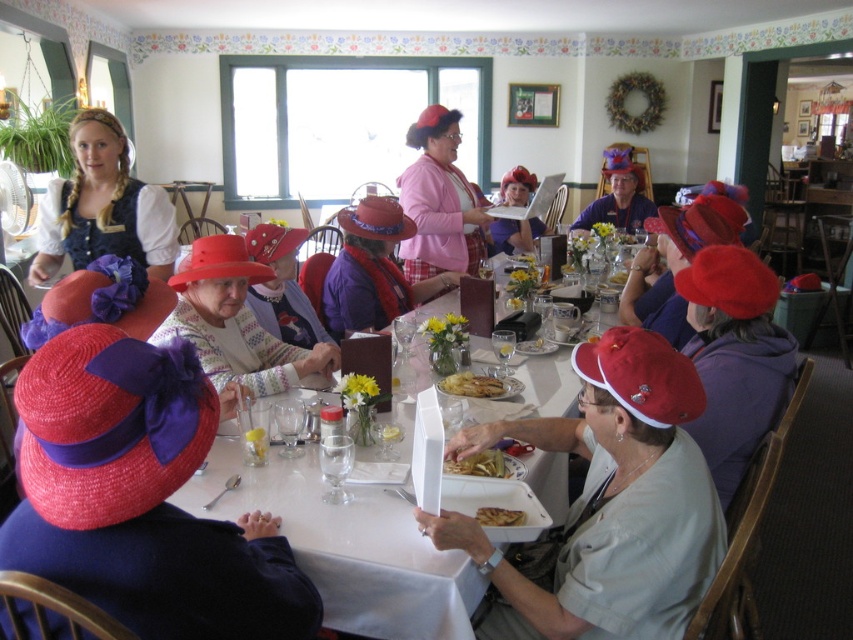
Consider the image. You are a photographer positioned at the back of the room. You need to capture a clear shot of both the matte pink hat at center and the golden crispy pastry at lower center. Considering their heights, which object might partially block the view of the other?

The matte pink hat at center is taller than the golden crispy pastry at lower center, so the matte pink hat at center could potentially block the view of the golden crispy pastry at lower center if positioned between the camera and the pastry.

You are a guest at this event and want to place a small decoration between the white paper plate at center and the matte straw hat at center. Which object should you place it closer to if you want the decoration to be at the same height as the taller object?

The white paper plate at center is shorter than the matte straw hat at center, so to match the height of the taller object, place the decoration closer to the matte straw hat at center.